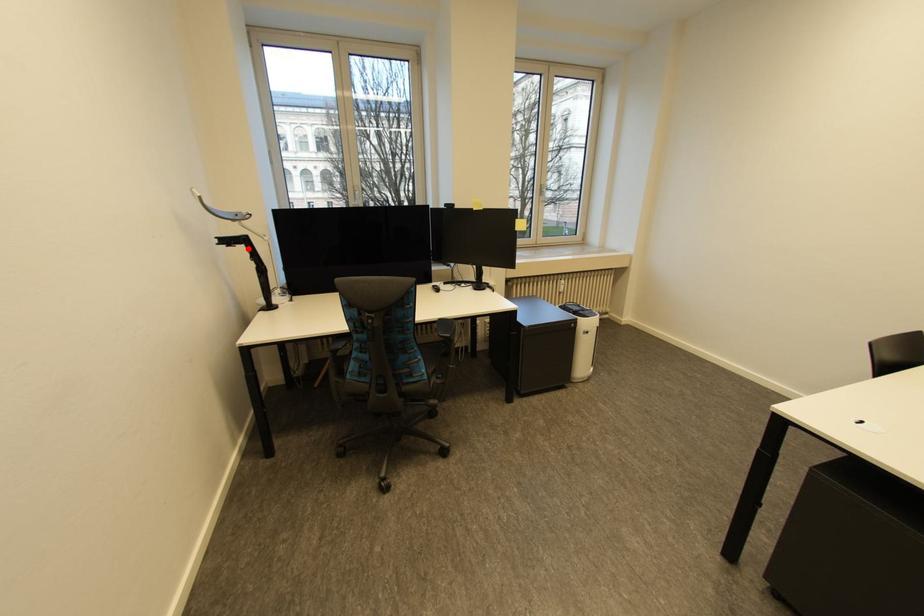
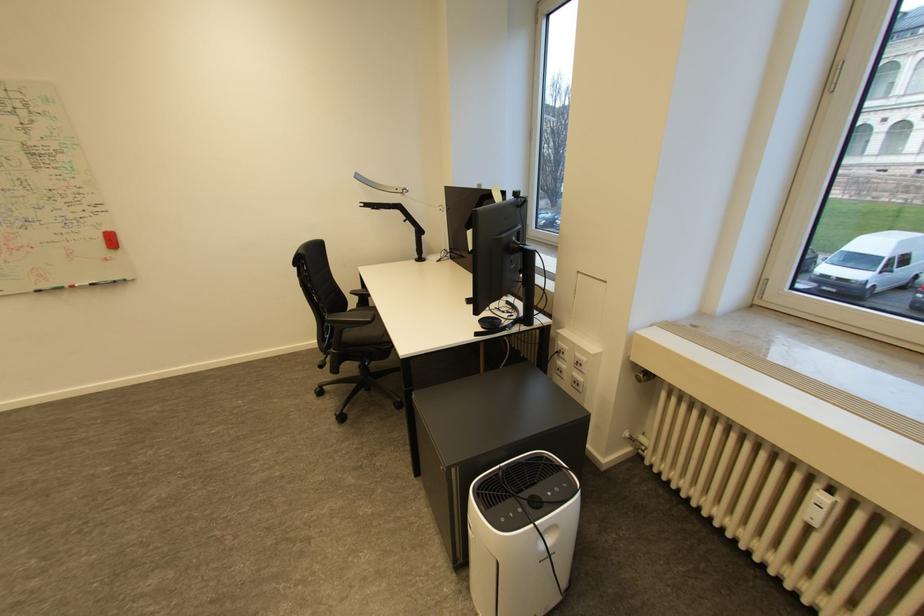
Locate, in the second image, the point that corresponds to the highlighted location in the first image.

(405, 213)